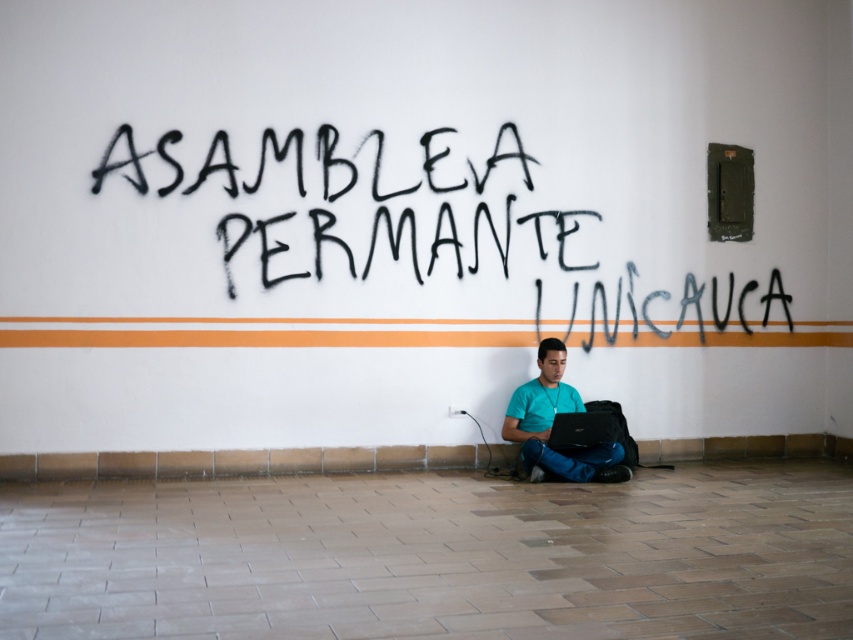
Which is more to the right, black spray paint graffiti at upper center or black matte laptop at lower center?

From the viewer's perspective, black spray paint graffiti at upper center appears more on the right side.

Is point (300, 195) less distant than point (550, 444)?

That is False.

Which is in front, point (531, 333) or point (573, 416)?

Point (573, 416) is in front.

Locate an element on the screen. black spray paint graffiti at upper center is located at coordinates (426, 237).

Does teal matte shirt at lower center appear over black matte laptop at lower center?

Yes.

Does teal matte shirt at lower center have a greater height compared to black matte laptop at lower center?

Indeed, teal matte shirt at lower center has a greater height compared to black matte laptop at lower center.

What do you see at coordinates (552, 422) in the screenshot? I see `teal matte shirt at lower center` at bounding box center [552, 422].

Find the location of a particular element. This screenshot has width=853, height=640. teal matte shirt at lower center is located at coordinates (552, 422).

Which of these two, black spray paint graffiti at upper center or teal matte shirt at lower center, stands shorter?

black spray paint graffiti at upper center is shorter.

Does black spray paint graffiti at upper center have a smaller size compared to teal matte shirt at lower center?

Yes.

The image size is (853, 640). Identify the location of black spray paint graffiti at upper center. (426, 237).

The width and height of the screenshot is (853, 640). In order to click on black spray paint graffiti at upper center in this screenshot , I will do `click(426, 237)`.